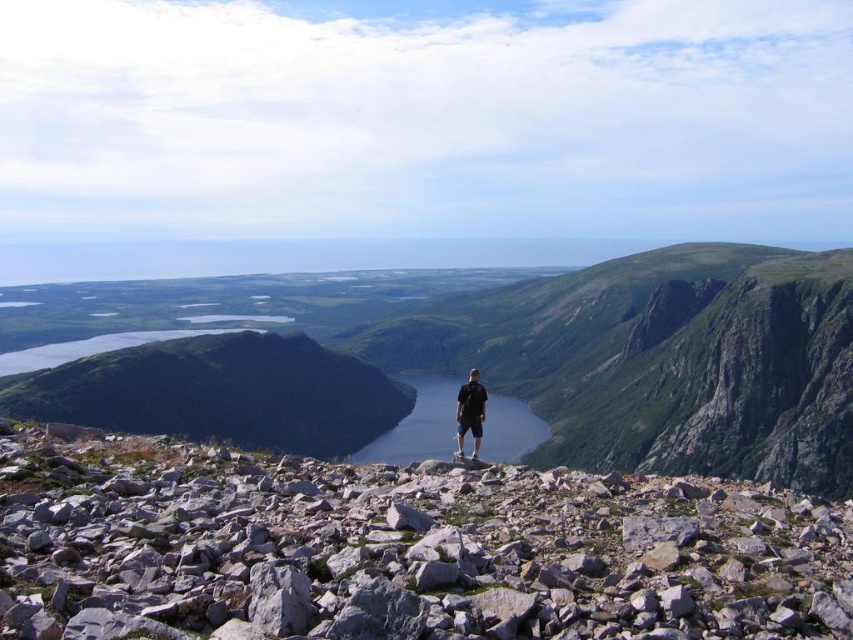
Measure the distance between gray rock at center and green grassy mountain at center.

The distance of gray rock at center from green grassy mountain at center is 251.47 meters.

Between point (549, 563) and point (595, 452), which one is positioned behind?

The point (595, 452) is behind.

Between point (769, 541) and point (828, 451), which one is positioned in front?

Point (769, 541) is in front.

Where is `gray rock at center`? The width and height of the screenshot is (853, 640). gray rock at center is located at coordinates (399, 550).

Between green grassy mountain at center and shiny blue water at center, which one appears on the left side from the viewer's perspective?

green grassy mountain at center

Consider the image. Who is positioned more to the right, green grassy mountain at center or shiny blue water at center?

shiny blue water at center is more to the right.

Is point (521, 291) positioned behind point (502, 428)?

Yes.

At what (x,y) coordinates should I click in order to perform the action: click on green grassy mountain at center. Please return your answer as a coordinate pair (x, y). Looking at the image, I should click on (581, 349).

Which is below, gray rock at center or shiny blue water at center?

shiny blue water at center is lower down.

Does gray rock at center have a larger size compared to shiny blue water at center?

Actually, gray rock at center might be smaller than shiny blue water at center.

Measure the distance between gray rock at center and camera.

gray rock at center is 14.63 meters from camera.

Where is `gray rock at center`? This screenshot has width=853, height=640. gray rock at center is located at coordinates click(x=399, y=550).